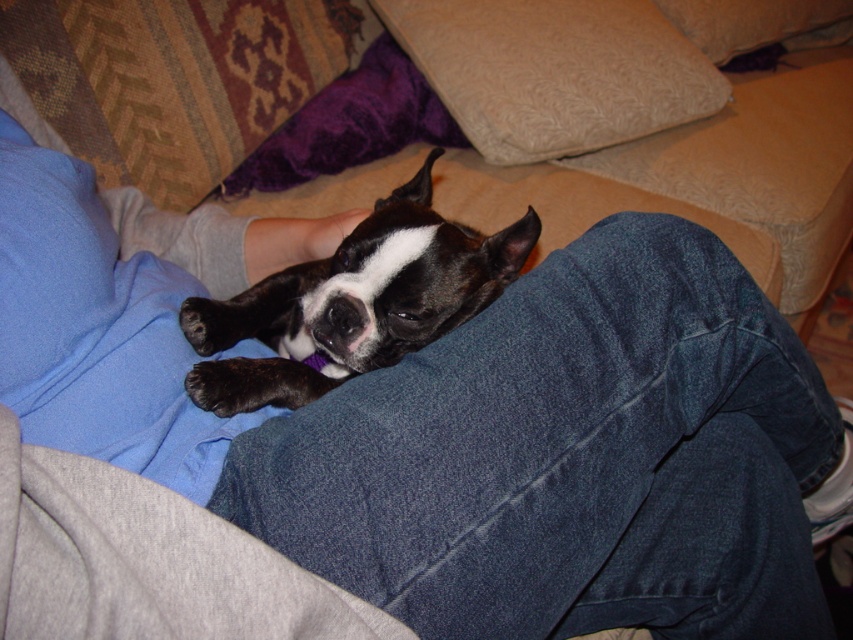
You are sitting on the couch and want to place a small toy between the two points in the scene. The first point is point (x=386, y=356) and the second point is point (x=427, y=52). Based on their positions, which point should you place the toy closer to so that it is in front of both points?

You should place the toy closer to point (x=427, y=52) because point (x=386, y=356) is in front of point (x=427, y=52). Placing the toy near the rear point ensures it is in front of both.

You are trying to place a decorative item on the couch in the image. You have a small vase that needs to be placed between the beige textured pillow at upper center and the blue fabric pillow at upper left. Is this possible given their positions?

The blue fabric pillow at upper left is behind the beige textured pillow at upper center, so there is no space between them for the vase to be placed in front. The vase cannot be placed between them as described.

You are a photographer trying to capture a closeup of the black matte dog at center without the beige textured pillow at upper center appearing in the background. Based on the scene, can you position yourself in a way to achieve this?

The black matte dog at center is in front of the beige textured pillow at upper center, so if you position yourself so that the dog blocks the view of the pillow, you can take the closeup without the pillow appearing in the background.